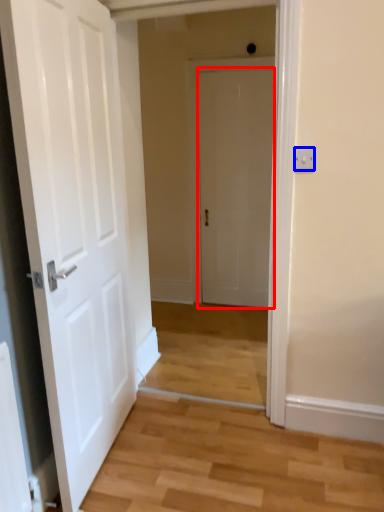
Question: Which point is further to the camera, door (highlighted by a red box) or electric outlet (highlighted by a blue box)?

Choices:
 (A) door
 (B) electric outlet

Answer: (A)